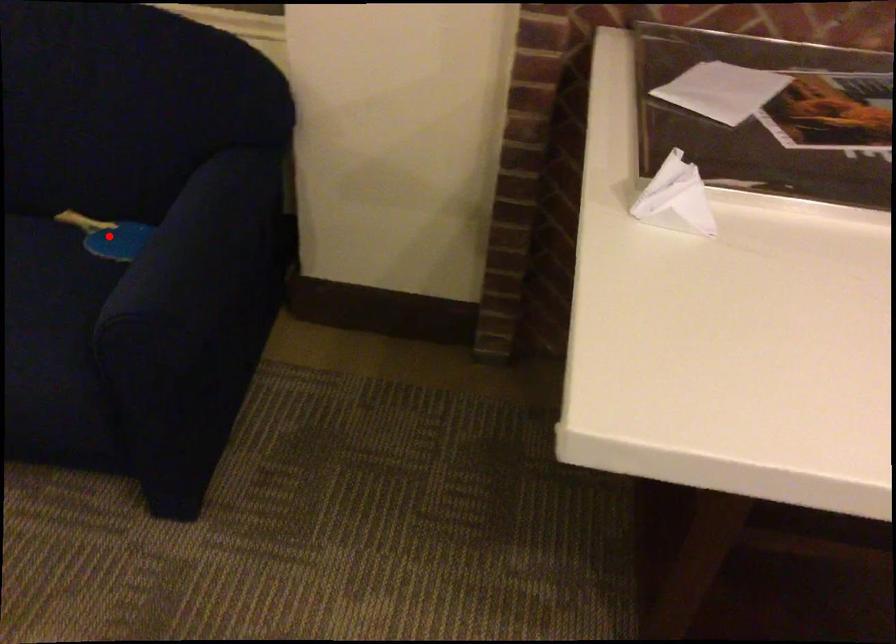
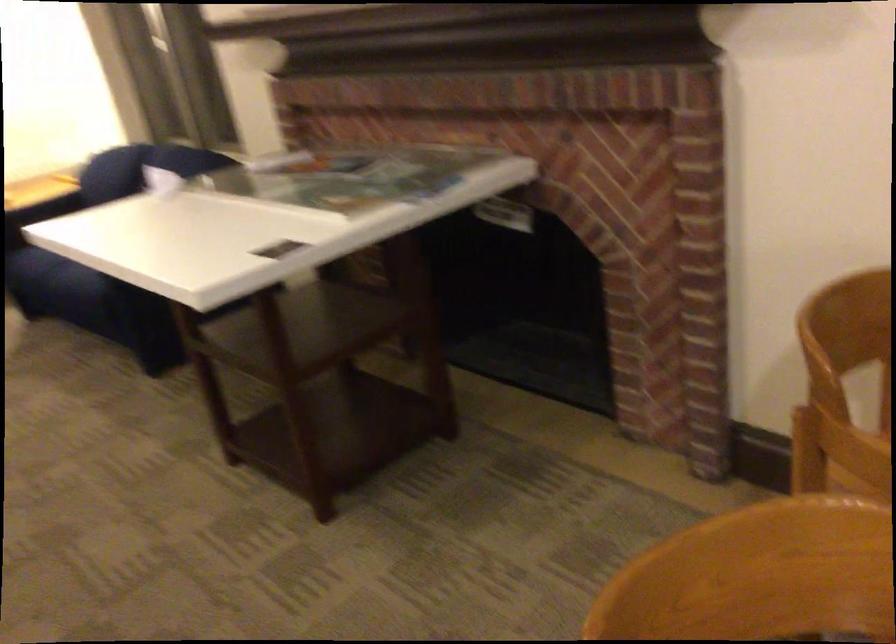
Question: I am providing you with two images of the same scene from different viewpoints. A red point is marked on the first image. Is the red point's position out of view in image 2?

Choices:
 (A) Yes
 (B) No

Answer: (A)